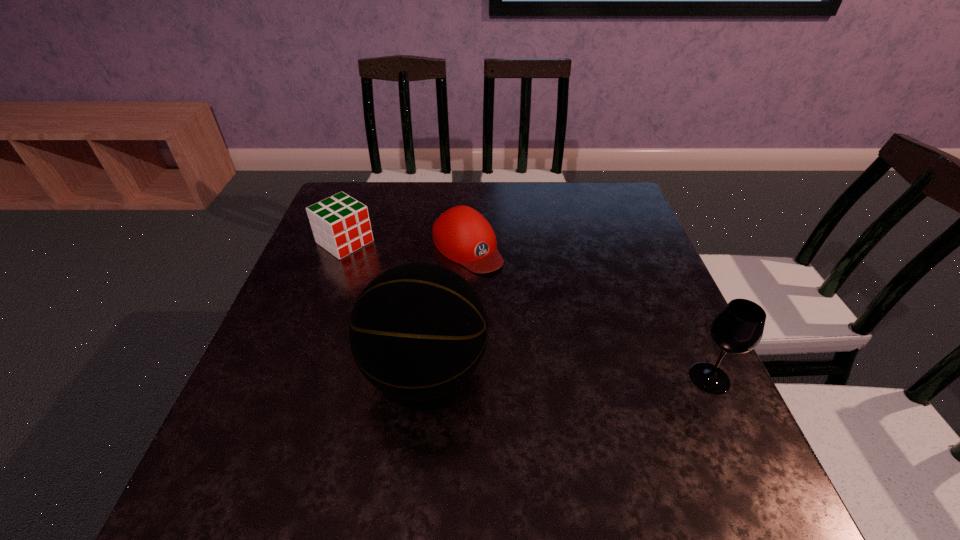
I want to click on basketball, so click(417, 332).

Find the location of a particular element. Image resolution: width=960 pixels, height=540 pixels. the second tallest object is located at coordinates (738, 328).

Identify the location of the rightmost object. Image resolution: width=960 pixels, height=540 pixels. (738, 328).

The height and width of the screenshot is (540, 960). What are the coordinates of `the leftmost object` in the screenshot? It's located at (340, 224).

Where is `baseball cap`? This screenshot has width=960, height=540. baseball cap is located at coordinates (461, 234).

Where is `vacant area situated on the back of the tallest object`? Image resolution: width=960 pixels, height=540 pixels. vacant area situated on the back of the tallest object is located at coordinates (440, 244).

You are a GUI agent. You are given a task and a screenshot of the screen. Output one action in this format:
    pyautogui.click(x=<x>, y=<y>)
    Task: Click on the free location located on the back of the wineglass
    This screenshot has width=960, height=540.
    Given the screenshot: What is the action you would take?
    pyautogui.click(x=665, y=282)

Find the location of a particular element. The height and width of the screenshot is (540, 960). free space located 0.090m on the red face of the leftmost object is located at coordinates (384, 269).

Locate an element on the screen. This screenshot has width=960, height=540. vacant space located 0.110m on the red face of the leftmost object is located at coordinates (389, 273).

You are a GUI agent. You are given a task and a screenshot of the screen. Output one action in this format:
    pyautogui.click(x=<x>, y=<y>)
    Task: Click on the free region located on the red face of the leftmost object
    The width and height of the screenshot is (960, 540).
    Given the screenshot: What is the action you would take?
    pyautogui.click(x=389, y=273)